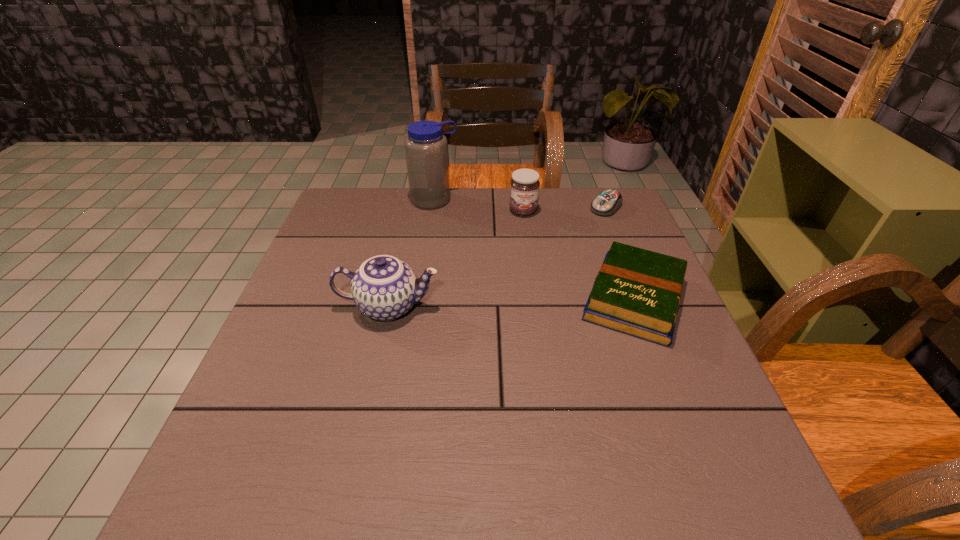
Locate an element on the screen. The height and width of the screenshot is (540, 960). vacant area that lies between the second shortest object and the tallest object is located at coordinates (535, 249).

Identify the location of free point between the third object from right to left and the chinaware. (456, 259).

Where is `vacant area that lies between the fourth tallest object and the chinaware`? The height and width of the screenshot is (540, 960). vacant area that lies between the fourth tallest object and the chinaware is located at coordinates (512, 303).

What are the coordinates of `free space that is in between the fourth shortest object and the computer mouse` in the screenshot? It's located at (497, 257).

In order to click on free spot between the computer mouse and the fourth shortest object in this screenshot , I will do `click(497, 257)`.

Locate an element on the screen. The image size is (960, 540). free point between the tallest object and the jam is located at coordinates (479, 205).

I want to click on vacant area between the fourth tallest object and the second tallest object, so click(x=512, y=303).

At what (x,y) coordinates should I click in order to perform the action: click on vacant area between the tallest object and the third shortest object. Please return your answer as a coordinate pair (x, y). This screenshot has height=540, width=960. Looking at the image, I should click on (479, 205).

Identify the location of vacant area that lies between the third tallest object and the second tallest object. (456, 259).

The image size is (960, 540). What are the coordinates of `unoccupied position between the second tallest object and the second shortest object` in the screenshot? It's located at (512, 303).